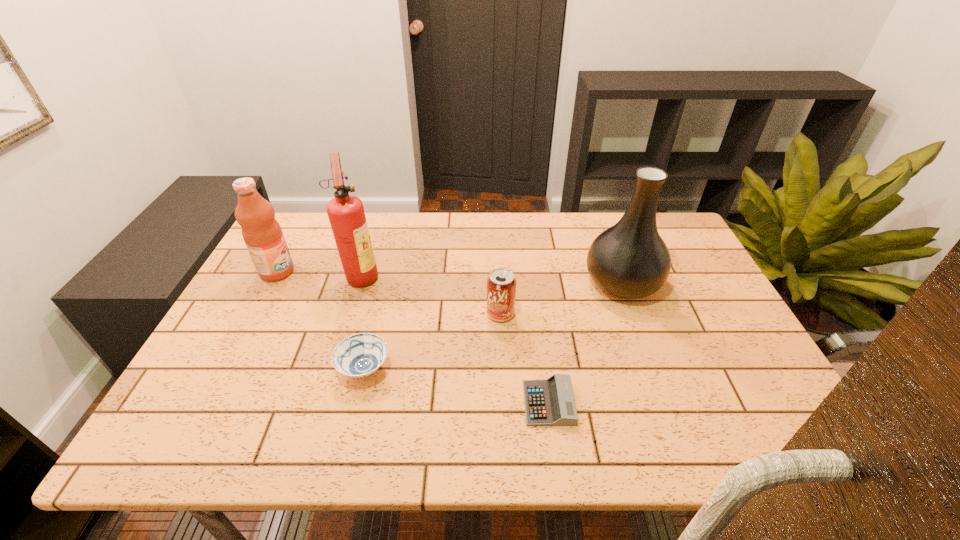
The width and height of the screenshot is (960, 540). I want to click on fire extinguisher, so click(346, 214).

What are the coordinates of `the rightmost object` in the screenshot? It's located at (630, 260).

At what (x,y) coordinates should I click in order to perform the action: click on the fourth shortest object. Please return your answer as a coordinate pair (x, y). This screenshot has width=960, height=540. Looking at the image, I should click on (262, 233).

Identify the location of the leftmost object. The width and height of the screenshot is (960, 540). (262, 233).

This screenshot has width=960, height=540. In order to click on soda can in this screenshot , I will do `click(501, 284)`.

You are a GUI agent. You are given a task and a screenshot of the screen. Output one action in this format:
    pyautogui.click(x=<x>, y=<y>)
    Task: Click on the third shortest object
    This screenshot has width=960, height=540.
    Given the screenshot: What is the action you would take?
    pyautogui.click(x=501, y=284)

Image resolution: width=960 pixels, height=540 pixels. Find the location of `soup bowl`. soup bowl is located at coordinates (360, 355).

The image size is (960, 540). What are the coordinates of `the second object from right to left` in the screenshot? It's located at (549, 402).

In order to click on the shortest object in this screenshot , I will do `click(549, 402)`.

Identify the location of vacant area situated on the front-facing side of the fire extinguisher. The height and width of the screenshot is (540, 960). (471, 275).